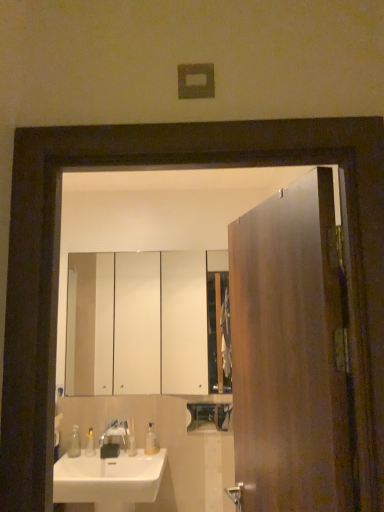
At what (x,y) coordinates should I click in order to perform the action: click on wooden door at right. Please return your answer as a coordinate pair (x, y). The height and width of the screenshot is (512, 384). Looking at the image, I should click on (290, 353).

Locate an element on the screen. This screenshot has height=512, width=384. white glossy sink at lower left is located at coordinates (109, 479).

What is the approximate width of transparent plastic soap dispenser at lower center, which ranks as the first soap dispenser in right-to-left order?

8.13 centimeters.

Where is `transparent plastic soap dispenser at lower center, which ranks as the first soap dispenser in right-to-left order`? The image size is (384, 512). transparent plastic soap dispenser at lower center, which ranks as the first soap dispenser in right-to-left order is located at coordinates (151, 441).

You are a GUI agent. You are given a task and a screenshot of the screen. Output one action in this format:
    pyautogui.click(x=<x>, y=<y>)
    Task: Click on the wooden door at right
    
    Given the screenshot: What is the action you would take?
    pyautogui.click(x=290, y=353)

Is transparent plastic soap dispenser at lower center, the 2th soap dispenser from the left, placed right next to white glossy cabinet at upper center?

No, transparent plastic soap dispenser at lower center, the 2th soap dispenser from the left, is not next to white glossy cabinet at upper center.

From the picture: Does transparent plastic soap dispenser at lower center, the 2th soap dispenser from the left, come behind white glossy cabinet at upper center?

No, transparent plastic soap dispenser at lower center, the 2th soap dispenser from the left, is in front of white glossy cabinet at upper center.

From a real-world perspective, between transparent plastic soap dispenser at lower center, which ranks as the first soap dispenser in right-to-left order, and white glossy cabinet at upper center, who is vertically lower?

transparent plastic soap dispenser at lower center, which ranks as the first soap dispenser in right-to-left order, from a real-world perspective.

From the image's perspective, which one is positioned higher, transparent plastic soap dispenser at lower center, which ranks as the first soap dispenser in right-to-left order, or white glossy cabinet at upper center?

white glossy cabinet at upper center is shown above in the image.

Between translucent plastic soap at lower left, which is the first toiletry in left-to-right order, and satin nickel faucet at sink left, which one appears on the left side from the viewer's perspective?

From the viewer's perspective, translucent plastic soap at lower left, which is the first toiletry in left-to-right order, appears more on the left side.

Is the position of translucent plastic soap at lower left, which is counted as the 2th toiletry, starting from the right, more distant than that of satin nickel faucet at sink left?

Yes, translucent plastic soap at lower left, which is counted as the 2th toiletry, starting from the right, is further from the camera.

From a real-world perspective, which object rests below the other?

From a 3D spatial view, translucent plastic soap at lower left, which is counted as the 2th toiletry, starting from the right, is below.

From the image's perspective, would you say translucent plastic soap at lower left, which is counted as the 2th toiletry, starting from the right, is shown under satin nickel faucet at sink left?

Yes, from the image's perspective, translucent plastic soap at lower left, which is counted as the 2th toiletry, starting from the right, is beneath satin nickel faucet at sink left.

Is white glossy cabinet at upper center positioned with its back to clear plastic soap dispenser at lower left, the second soap dispenser viewed from the right?

No, clear plastic soap dispenser at lower left, the second soap dispenser viewed from the right, is not at the back of white glossy cabinet at upper center.

From the picture: From a real-world perspective, which is physically above, white glossy cabinet at upper center or clear plastic soap dispenser at lower left, the second soap dispenser viewed from the right?

From a 3D spatial view, white glossy cabinet at upper center is above.

Looking at this image, is white glossy cabinet at upper center thinner than clear plastic soap dispenser at lower left, which is the 1th soap dispenser in left-to-right order?

Yes, white glossy cabinet at upper center is thinner than clear plastic soap dispenser at lower left, which is the 1th soap dispenser in left-to-right order.

From a real-world perspective, is clear plastic soap dispenser at lower left, which is the 1th soap dispenser in left-to-right order, under white glossy cabinet at upper center?

Yes.

At what (x,y) coordinates should I click in order to perform the action: click on cabinetry that is behind the clear plastic soap dispenser at lower left, the second soap dispenser viewed from the right. Please return your answer as a coordinate pair (x, y). The height and width of the screenshot is (512, 384). Looking at the image, I should click on (139, 323).

Is the depth of clear plastic soap dispenser at lower left, the second soap dispenser viewed from the right, less than that of white glossy cabinet at upper center?

Yes, clear plastic soap dispenser at lower left, the second soap dispenser viewed from the right, is closer to the viewer.

In the scene shown: Does clear plastic soap dispenser at lower left, the second soap dispenser viewed from the right, appear on the left side of white glossy cabinet at upper center?

Yes.

Is satin nickel faucet at sink left bigger or smaller than translucent plastic soap at lower left, which is the first toiletry in left-to-right order?

satin nickel faucet at sink left is bigger than translucent plastic soap at lower left, which is the first toiletry in left-to-right order.

From a real-world perspective, is satin nickel faucet at sink left above or below translucent plastic soap at lower left, which is counted as the 2th toiletry, starting from the right?

satin nickel faucet at sink left is situated higher than translucent plastic soap at lower left, which is counted as the 2th toiletry, starting from the right, in the real world.

Which object is positioned more to the left, satin nickel faucet at sink left or translucent plastic soap at lower left, which is counted as the 2th toiletry, starting from the right?

From the viewer's perspective, translucent plastic soap at lower left, which is counted as the 2th toiletry, starting from the right, appears more on the left side.

Which object is more forward, satin nickel faucet at sink left or translucent plastic soap at lower left, which is the first toiletry in left-to-right order?

satin nickel faucet at sink left.

Is wooden door at right thinner than translucent plastic soap at center, marked as the first toiletry in a right-to-left arrangement?

No, wooden door at right is not thinner than translucent plastic soap at center, marked as the first toiletry in a right-to-left arrangement.

Is wooden door at right smaller than translucent plastic soap at center, which is the 2th toiletry from left to right?

Actually, wooden door at right might be larger than translucent plastic soap at center, which is the 2th toiletry from left to right.

From the picture: Which is behind, wooden door at right or translucent plastic soap at center, marked as the first toiletry in a right-to-left arrangement?

translucent plastic soap at center, marked as the first toiletry in a right-to-left arrangement, is more distant.

Is translucent plastic soap at lower left, which is the first toiletry in left-to-right order, situated inside white glossy sink at lower left or outside?

translucent plastic soap at lower left, which is the first toiletry in left-to-right order, is outside white glossy sink at lower left.

From the image's perspective, would you say translucent plastic soap at lower left, which is the first toiletry in left-to-right order, is positioned over white glossy sink at lower left?

Yes.

Which of these two, translucent plastic soap at lower left, which is the first toiletry in left-to-right order, or white glossy sink at lower left, is smaller?

translucent plastic soap at lower left, which is the first toiletry in left-to-right order, is smaller.

Is translucent plastic soap at lower left, which is counted as the 2th toiletry, starting from the right, closer to camera compared to white glossy sink at lower left?

No, it is behind white glossy sink at lower left.

Locate an element on the screen. This screenshot has width=384, height=512. cabinetry that appears on the left of transparent plastic soap dispenser at lower center, which ranks as the first soap dispenser in right-to-left order is located at coordinates (139, 323).

From the image's perspective, which toiletry is the 1st one below the satin nickel faucet at sink left? Please provide its 2D coordinates.

[(90, 444)]

Which object lies further to the anchor point satin nickel faucet at sink left, translucent plastic soap at lower left, which is counted as the 2th toiletry, starting from the right, or wooden door at right?

wooden door at right lies further to satin nickel faucet at sink left than the other object.

Considering their positions, is wooden door at right positioned further to white glossy sink at lower left than transparent plastic soap dispenser at lower center, which ranks as the first soap dispenser in right-to-left order?

wooden door at right lies further to white glossy sink at lower left than the other object.

When comparing their distances from white glossy sink at lower left, does clear plastic soap dispenser at lower left, the second soap dispenser viewed from the right, or transparent plastic soap dispenser at lower center, which ranks as the first soap dispenser in right-to-left order, seem further?

The object further to white glossy sink at lower left is transparent plastic soap dispenser at lower center, which ranks as the first soap dispenser in right-to-left order.

From the picture: Estimate the real-world distances between objects in this image. Which object is closer to transparent plastic soap dispenser at lower center, the 2th soap dispenser from the left, clear plastic soap dispenser at lower left, the second soap dispenser viewed from the right, or white glossy cabinet at upper center?

Among the two, clear plastic soap dispenser at lower left, the second soap dispenser viewed from the right, is located nearer to transparent plastic soap dispenser at lower center, the 2th soap dispenser from the left.

Estimate the real-world distances between objects in this image. Which object is closer to white glossy cabinet at upper center, translucent plastic soap at center, which is the 2th toiletry from left to right, or translucent plastic soap at lower left, which is counted as the 2th toiletry, starting from the right?

translucent plastic soap at center, which is the 2th toiletry from left to right, is closer to white glossy cabinet at upper center.

Estimate the real-world distances between objects in this image. Which object is closer to translucent plastic soap at center, marked as the first toiletry in a right-to-left arrangement, wooden door at right or clear plastic soap dispenser at lower left, the second soap dispenser viewed from the right?

clear plastic soap dispenser at lower left, the second soap dispenser viewed from the right.

Which object lies nearer to the anchor point white glossy cabinet at upper center, wooden door at right or satin nickel faucet at sink left?

satin nickel faucet at sink left is positioned closer to the anchor white glossy cabinet at upper center.

Considering their positions, is translucent plastic soap at center, marked as the first toiletry in a right-to-left arrangement, positioned closer to white glossy sink at lower left than satin nickel faucet at sink left?

satin nickel faucet at sink left lies closer to white glossy sink at lower left than the other object.

The image size is (384, 512). In order to click on tap that lies between white glossy cabinet at upper center and white glossy sink at lower left from top to bottom in this screenshot , I will do `click(115, 434)`.

I want to click on tap situated between clear plastic soap dispenser at lower left, the second soap dispenser viewed from the right, and transparent plastic soap dispenser at lower center, the 2th soap dispenser from the left, from left to right, so click(x=115, y=434).

Where is `soap dispenser between white glossy sink at lower left and translucent plastic soap at center, which is the 2th toiletry from left to right, from front to back`? Image resolution: width=384 pixels, height=512 pixels. soap dispenser between white glossy sink at lower left and translucent plastic soap at center, which is the 2th toiletry from left to right, from front to back is located at coordinates (74, 443).

This screenshot has height=512, width=384. Identify the location of soap dispenser between white glossy cabinet at upper center and clear plastic soap dispenser at lower left, the second soap dispenser viewed from the right, from top to bottom. pyautogui.click(x=151, y=441).